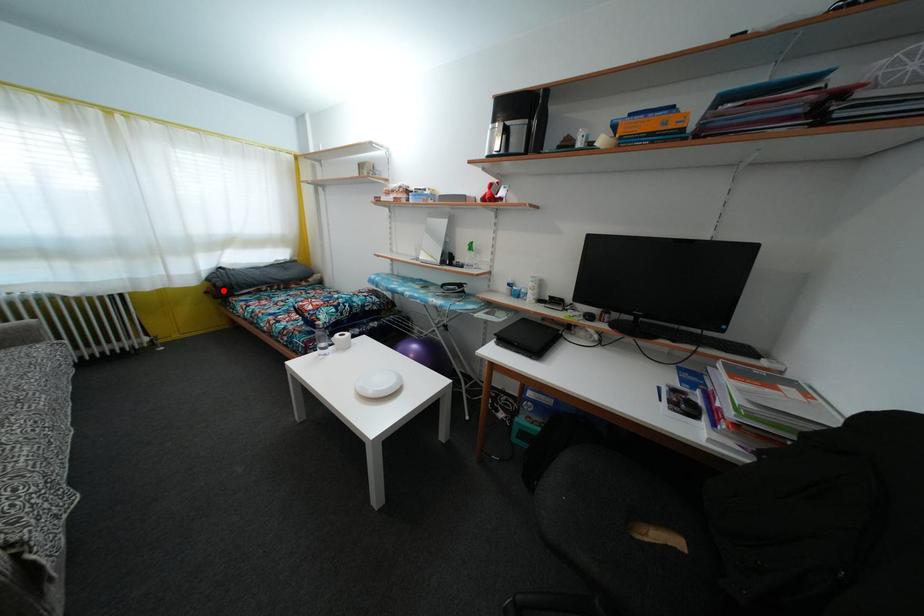
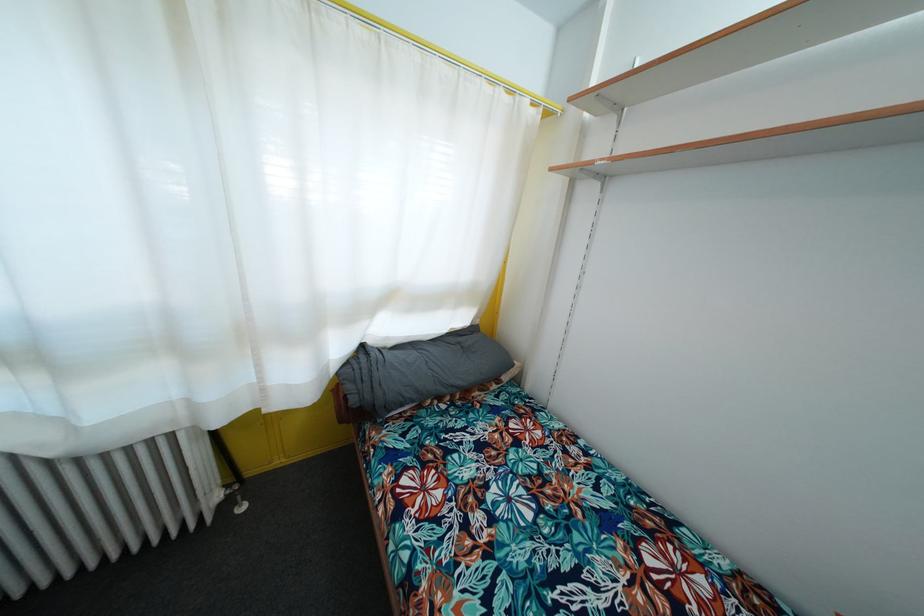
Question: I am providing you with two images of the same scene from different viewpoints. Given a red point in image1, look at the same physical point in image2. Is it:

Choices:
 (A) Closer to the viewpoint
 (B) Farther from the viewpoint

Answer: (B)